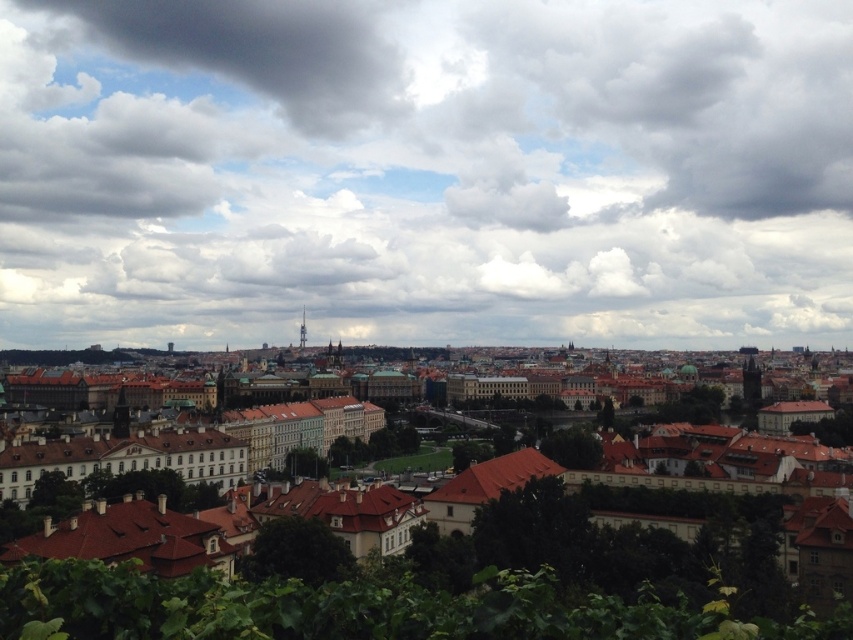
You are an architect analyzing the cityscape. You notice the cloudy sky at center and the brown stone buildings at center. Which of these two elements is located to the right of the other?

The cloudy sky at center is positioned on the right side of brown stone buildings at center.

You are an architect planning to install a large solar panel array on the rooftop of the building closest to the cloudy sky at center. Based on the coordinates provided, which building should you target?

The cloudy sky at center is located at coordinates point (425, 172). The building closest to this position would be the one in the midground with red tiled roofs, as it is situated closer to the sky compared to the distant urban background buildings.

You are standing in the cityscape scene and want to determine which of the two points, point (x=56, y=58) or point (x=67, y=536), is closer to you. Which point is nearer?

Point (x=56, y=58) is further to the viewer than point (x=67, y=536), so the closer point is point (x=67, y=536).